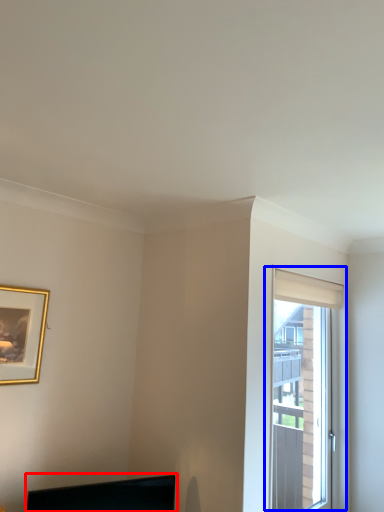
Question: Which of the following is the closest to the observer, computer monitor (highlighted by a red box) or window (highlighted by a blue box)?

Choices:
 (A) computer monitor
 (B) window

Answer: (A)